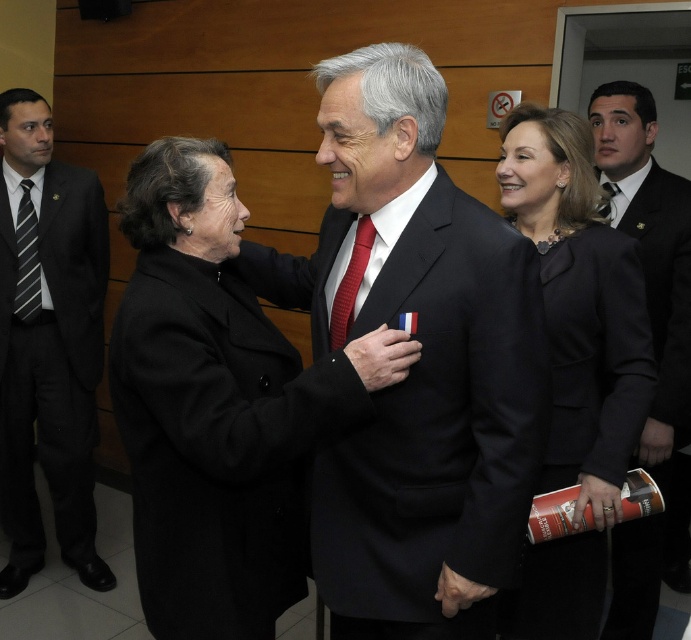
In the scene shown: You are a fashion consultant helping a client choose between two ties for a formal event. The client wants to know which tie is thinner between the red silk tie at center and the matte red tie at center. Based on the image, which one is thinner?

The red silk tie at center is thinner than the matte red tie at center according to the description.